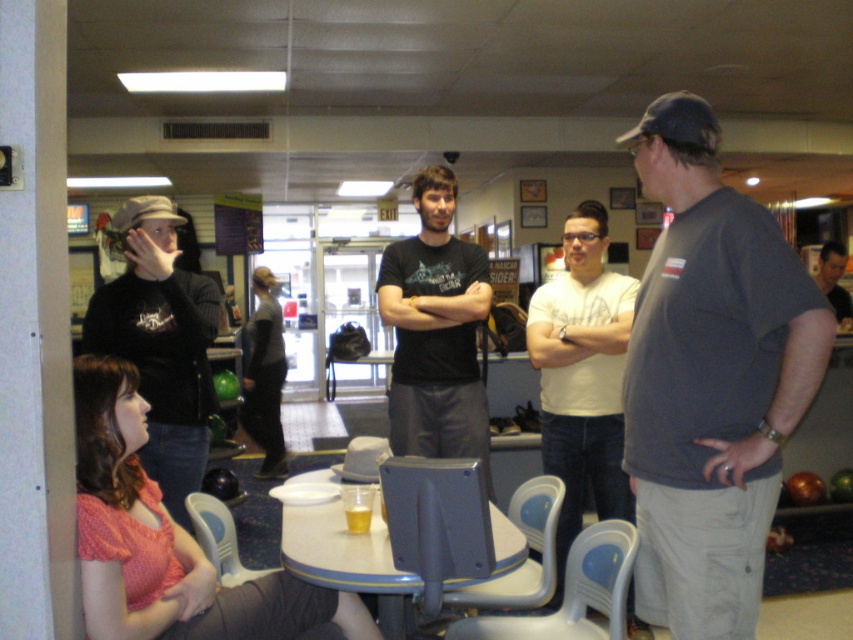
Question: Is dark gray t-shirt at right wider than matte black shirt at left?

Choices:
 (A) yes
 (B) no

Answer: (B)

Question: Which object is positioned farthest from the white matte t-shirt at center?

Choices:
 (A) matte black shirt at center
 (B) dark gray sweater at center
 (C) white plastic table at center

Answer: (B)

Question: Which point is closer to the camera taking this photo?

Choices:
 (A) (375, 449)
 (B) (834, 257)
 (C) (605, 468)
 (D) (152, 196)

Answer: (A)

Question: Among these objects, which one is farthest from the camera?

Choices:
 (A) dark gray t-shirt at right
 (B) white plastic chair at center

Answer: (B)

Question: Can you confirm if matte black shirt at left is wider than gray fabric chair at center?

Choices:
 (A) no
 (B) yes

Answer: (B)

Question: Is white matte t-shirt at center closer to camera compared to gray fabric chair at center?

Choices:
 (A) yes
 (B) no

Answer: (B)